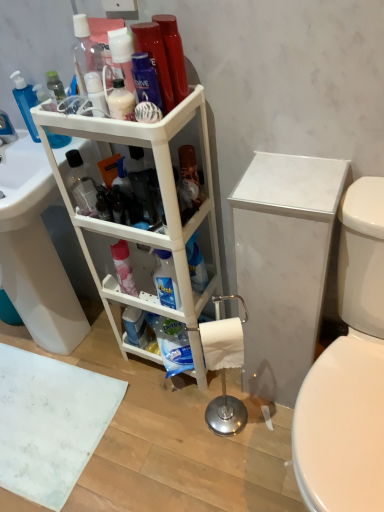
Image resolution: width=384 pixels, height=512 pixels. Find the location of `space that is in front of white marble cabinet at right`. space that is in front of white marble cabinet at right is located at coordinates (267, 436).